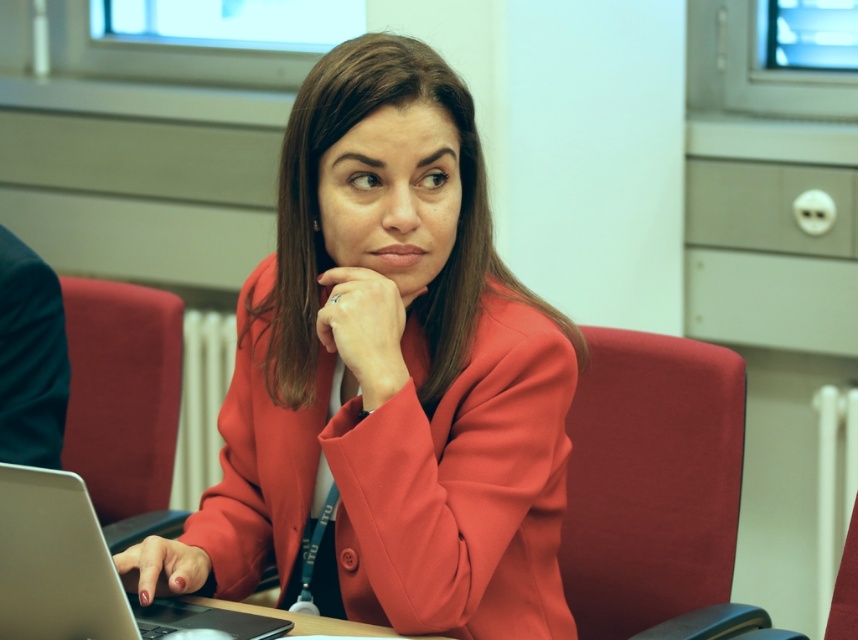
Is matte red blazer at center positioned before silver metallic laptop at lower left?

No, it is not.

The height and width of the screenshot is (640, 858). Describe the element at coordinates (388, 378) in the screenshot. I see `matte red blazer at center` at that location.

Image resolution: width=858 pixels, height=640 pixels. What do you see at coordinates (388, 378) in the screenshot? I see `matte red blazer at center` at bounding box center [388, 378].

The height and width of the screenshot is (640, 858). I want to click on matte red blazer at center, so click(x=388, y=378).